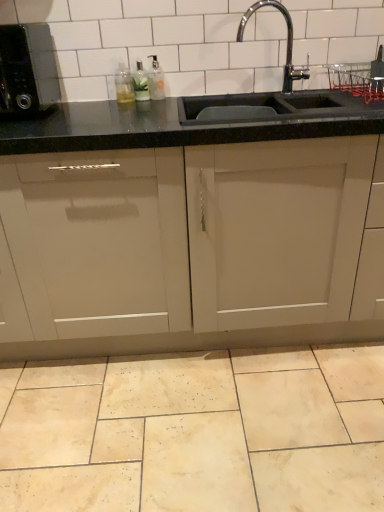
Question: Does black granite sink at upper center appear on the left side of translucent plastic bottle at upper left, which ranks as the 1th bottle in left-to-right order?

Choices:
 (A) no
 (B) yes

Answer: (A)

Question: Can you confirm if black granite sink at upper center is smaller than translucent plastic bottle at upper left, which ranks as the 1th bottle in left-to-right order?

Choices:
 (A) yes
 (B) no

Answer: (B)

Question: Is black granite sink at upper center not within translucent plastic bottle at upper left, the 3th bottle positioned from the right?

Choices:
 (A) yes
 (B) no

Answer: (A)

Question: Is black granite sink at upper center closer to camera compared to translucent plastic bottle at upper left, the 3th bottle positioned from the right?

Choices:
 (A) no
 (B) yes

Answer: (B)

Question: Is translucent plastic bottle at upper left, the 3th bottle positioned from the right, at the back of black granite sink at upper center?

Choices:
 (A) yes
 (B) no

Answer: (B)

Question: Based on their sizes in the image, would you say clear glass bottle at upper center, the third bottle in the left-to-right sequence, is bigger or smaller than matte beige cabinet at center?

Choices:
 (A) small
 (B) big

Answer: (A)

Question: From a real-world perspective, is clear glass bottle at upper center, which is the first bottle from right to left, positioned above or below matte beige cabinet at center?

Choices:
 (A) below
 (B) above

Answer: (B)

Question: Do you think clear glass bottle at upper center, the third bottle in the left-to-right sequence, is within matte beige cabinet at center, or outside of it?

Choices:
 (A) inside
 (B) outside

Answer: (B)

Question: From their relative heights in the image, would you say clear glass bottle at upper center, which is the first bottle from right to left, is taller or shorter than matte beige cabinet at center?

Choices:
 (A) short
 (B) tall

Answer: (A)

Question: Choose the correct answer: Is beige marble tile at lower center inside translucent plastic bottle at upper left, the 3th bottle positioned from the right, or outside it?

Choices:
 (A) inside
 (B) outside

Answer: (B)

Question: Is beige marble tile at lower center bigger or smaller than translucent plastic bottle at upper left, the 3th bottle positioned from the right?

Choices:
 (A) big
 (B) small

Answer: (A)

Question: In terms of height, does beige marble tile at lower center look taller or shorter compared to translucent plastic bottle at upper left, the 3th bottle positioned from the right?

Choices:
 (A) tall
 (B) short

Answer: (B)

Question: Considering the relative positions of beige marble tile at lower center and translucent plastic bottle at upper left, the 3th bottle positioned from the right, in the image provided, is beige marble tile at lower center to the left or to the right of translucent plastic bottle at upper left, the 3th bottle positioned from the right,?

Choices:
 (A) right
 (B) left

Answer: (A)

Question: Based on their positions, is beige marble tile at lower center located to the left or right of matte beige cabinet at center?

Choices:
 (A) left
 (B) right

Answer: (A)

Question: Is beige marble tile at lower center taller or shorter than matte beige cabinet at center?

Choices:
 (A) tall
 (B) short

Answer: (B)